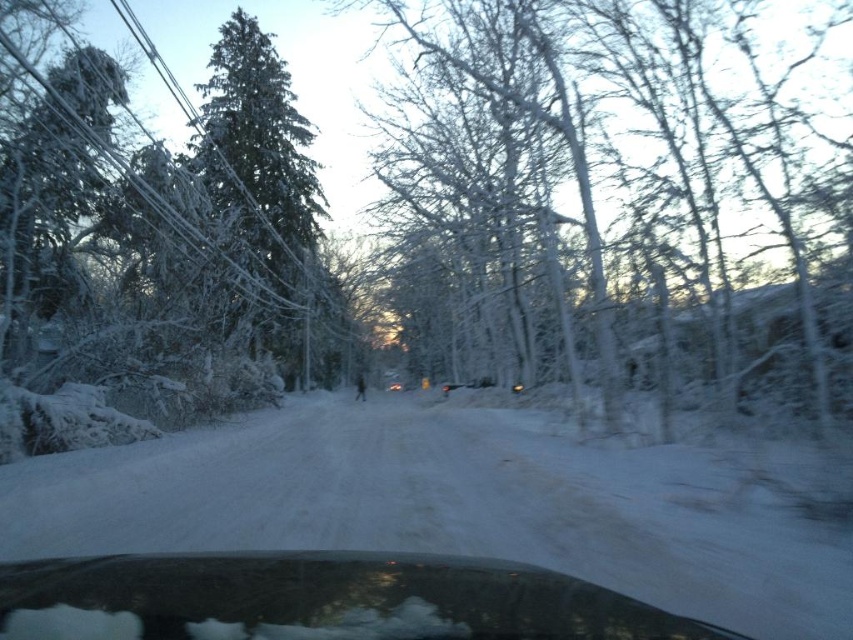
Question: Observing the image, what is the correct spatial positioning of white frosty tree at center in reference to transparent glass car window at lower center?

Choices:
 (A) left
 (B) right

Answer: (B)

Question: Is white fluffy snow at center below transparent glass car window at lower center?

Choices:
 (A) no
 (B) yes

Answer: (B)

Question: Estimate the real-world distances between objects in this image. Which object is closer to the transparent glass car window at lower center?

Choices:
 (A) white fluffy snow at center
 (B) white frosty tree at center

Answer: (A)

Question: Which is nearer to the transparent glass car window at lower center?

Choices:
 (A) white fluffy snow at center
 (B) white frosty tree at center

Answer: (A)

Question: Does white frosty tree at center appear over white fluffy snow at center?

Choices:
 (A) yes
 (B) no

Answer: (A)

Question: Among these objects, which one is nearest to the camera?

Choices:
 (A) green frosted evergreen at left
 (B) white frosty tree at center
 (C) transparent glass car window at lower center

Answer: (C)